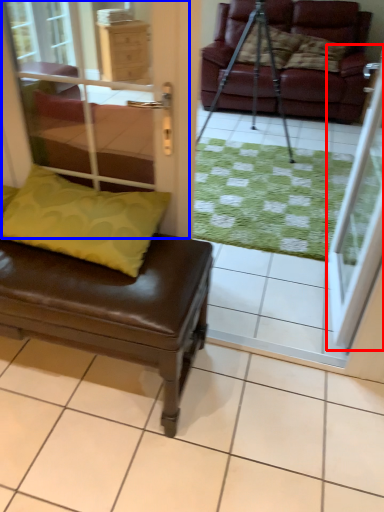
Question: Which object is further to the camera taking this photo, screen door (highlighted by a red box) or screen door (highlighted by a blue box)?

Choices:
 (A) screen door
 (B) screen door

Answer: (A)